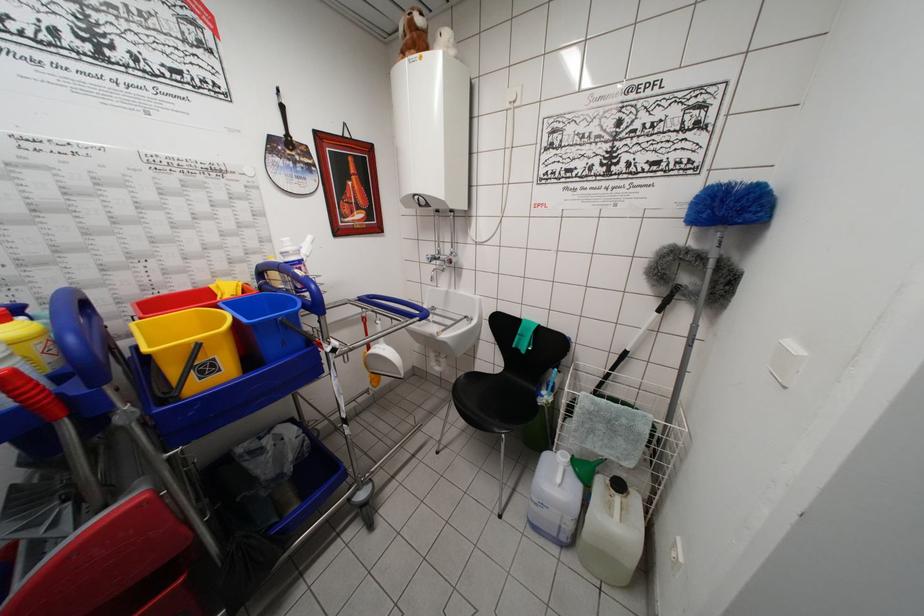
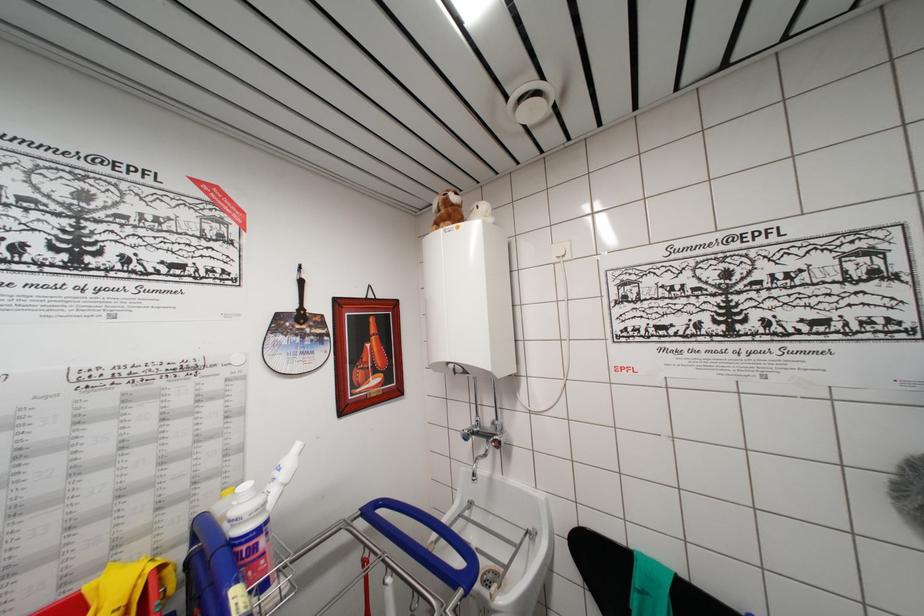
Which direction would the cameraman need to move to produce the second image?

The cameraman moved toward left, forward.